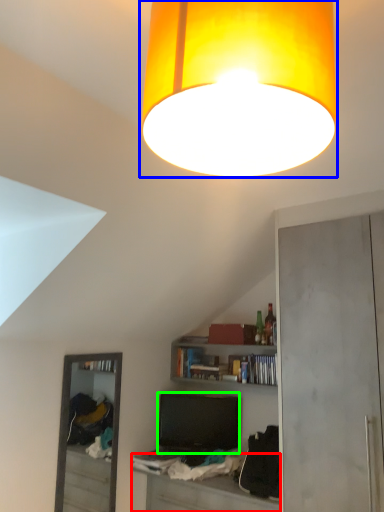
Question: Which is nearer to the table (highlighted by a red box)? lamp (highlighted by a blue box) or television (highlighted by a green box).

Choices:
 (A) lamp
 (B) television

Answer: (B)